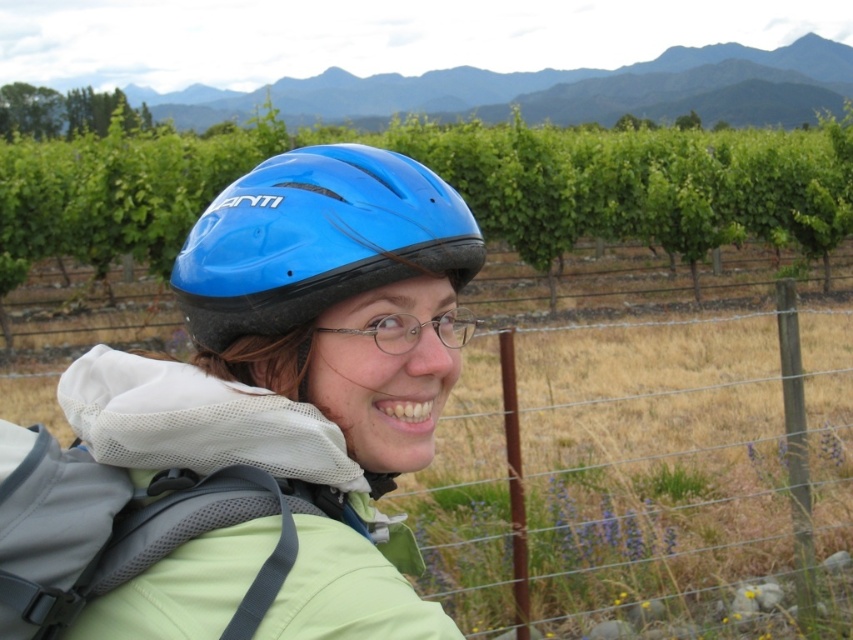
You are standing at the point with coordinates point (640, 516) and want to take a photo of the vineyard in the background. The camera you have can focus on subjects up to 15 feet away. Will the camera be able to capture the vineyard clearly?

The distance between point (640, 516) and the camera is 12.93 feet, which is within the camera focus range of 15 feet. Therefore, the camera can capture the vineyard clearly.

You are a photographer trying to capture a clear shot of the vineyard in the background. The wire mesh fence at center and the blue matte helmet at center are blocking your view. Which object should you move to get a clearer view of the vineyard?

The wire mesh fence at center is positioned under the blue matte helmet at center. To get a clearer view of the vineyard, you should move the wire mesh fence at center since it is closer to the camera and blocking the foreground, while the blue matte helmet at center is above it and might still allow viewing the vineyard beyond.